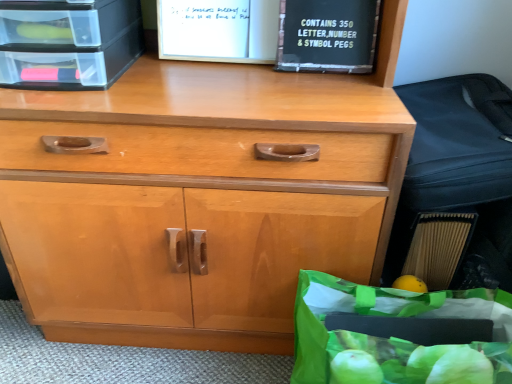
Question: Is clear plastic crate at upper left inside or outside of black plastic sign at upper right?

Choices:
 (A) outside
 (B) inside

Answer: (A)

Question: In terms of size, does clear plastic crate at upper left appear bigger or smaller than black plastic sign at upper right?

Choices:
 (A) big
 (B) small

Answer: (A)

Question: Estimate the real-world distances between objects in this image. Which object is farther from the black plastic book at upper center?

Choices:
 (A) green plastic bag at lower right
 (B) black plastic sign at upper right
 (C) clear plastic crate at upper left

Answer: (A)

Question: Considering the real-world distances, which object is farthest from the black plastic book at upper center?

Choices:
 (A) black plastic sign at upper right
 (B) green plastic bag at lower right
 (C) clear plastic crate at upper left

Answer: (B)